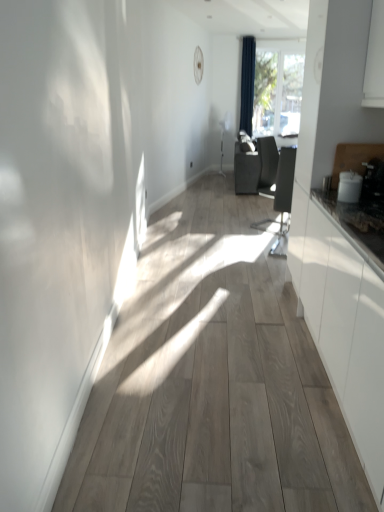
Question: Is dark blue fabric curtain at upper center at the back of transparent glass window at upper center?

Choices:
 (A) no
 (B) yes

Answer: (A)

Question: Are transparent glass window at upper center and dark blue fabric curtain at upper center located far from each other?

Choices:
 (A) yes
 (B) no

Answer: (B)

Question: Does transparent glass window at upper center lie in front of dark blue fabric curtain at upper center?

Choices:
 (A) yes
 (B) no

Answer: (B)

Question: Is transparent glass window at upper center oriented towards dark blue fabric curtain at upper center?

Choices:
 (A) no
 (B) yes

Answer: (A)

Question: From the image's perspective, is transparent glass window at upper center on top of dark blue fabric curtain at upper center?

Choices:
 (A) no
 (B) yes

Answer: (B)

Question: Does transparent glass window at upper center have a greater width compared to dark blue fabric curtain at upper center?

Choices:
 (A) yes
 (B) no

Answer: (B)

Question: From the image's perspective, is matte black swivel chair at center on dark blue fabric curtain at upper center?

Choices:
 (A) yes
 (B) no

Answer: (B)

Question: Can you confirm if matte black swivel chair at center is bigger than dark blue fabric curtain at upper center?

Choices:
 (A) yes
 (B) no

Answer: (A)

Question: From a real-world perspective, is matte black swivel chair at center positioned under dark blue fabric curtain at upper center based on gravity?

Choices:
 (A) yes
 (B) no

Answer: (A)

Question: Is matte black swivel chair at center taller than dark blue fabric curtain at upper center?

Choices:
 (A) yes
 (B) no

Answer: (B)

Question: Is matte black swivel chair at center thinner than dark blue fabric curtain at upper center?

Choices:
 (A) yes
 (B) no

Answer: (B)

Question: Can we say matte black swivel chair at center lies outside dark blue fabric curtain at upper center?

Choices:
 (A) no
 (B) yes

Answer: (B)

Question: Is matte black swivel chair at center in front of transparent glass window at upper center?

Choices:
 (A) yes
 (B) no

Answer: (A)